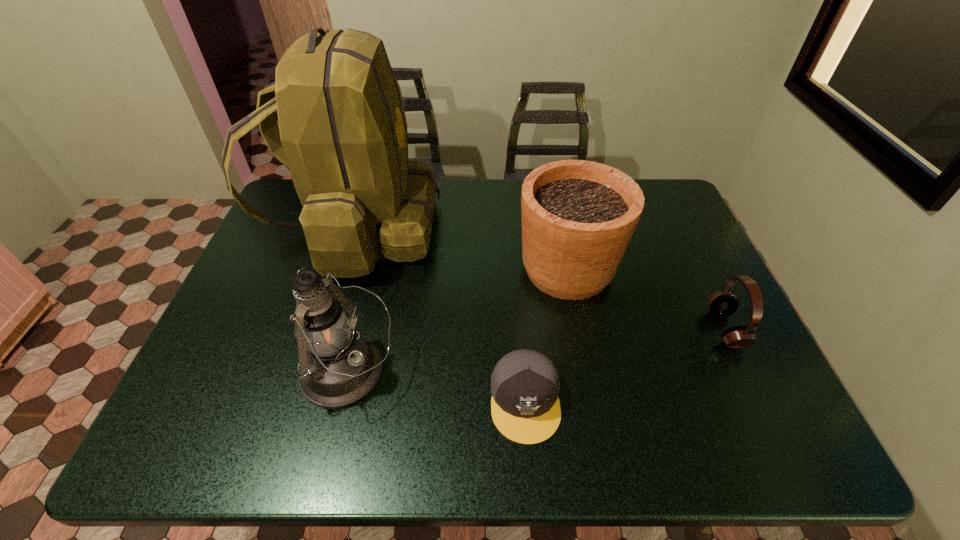
In the image, there is a desktop. Where is `vacant space at the right edge`? vacant space at the right edge is located at coordinates (678, 303).

In the image, there is a desktop. At what (x,y) coordinates should I click in order to perform the action: click on vacant space at the far left corner. Please return your answer as a coordinate pair (x, y). Image resolution: width=960 pixels, height=540 pixels. Looking at the image, I should click on (293, 183).

The height and width of the screenshot is (540, 960). I want to click on vacant area that lies between the headset and the shortest object, so click(x=625, y=365).

Locate an element on the screen. This screenshot has width=960, height=540. vacant space in between the third tallest object and the fourth shortest object is located at coordinates (458, 321).

The image size is (960, 540). Find the location of `vacant area between the oil lamp and the flowerpot`. vacant area between the oil lamp and the flowerpot is located at coordinates (458, 321).

At what (x,y) coordinates should I click in order to perform the action: click on vacant space in between the oil lamp and the rightmost object. Please return your answer as a coordinate pair (x, y). Looking at the image, I should click on (537, 350).

Find the location of a particular element. free spot between the third shortest object and the shortest object is located at coordinates (546, 335).

Locate an element on the screen. unoccupied area between the rightmost object and the oil lamp is located at coordinates (537, 350).

Find the location of a particular element. free space between the fourth shortest object and the third tallest object is located at coordinates coord(458,321).

The height and width of the screenshot is (540, 960). In order to click on empty space between the flowerpot and the fourth tallest object in this screenshot , I will do `click(646, 299)`.